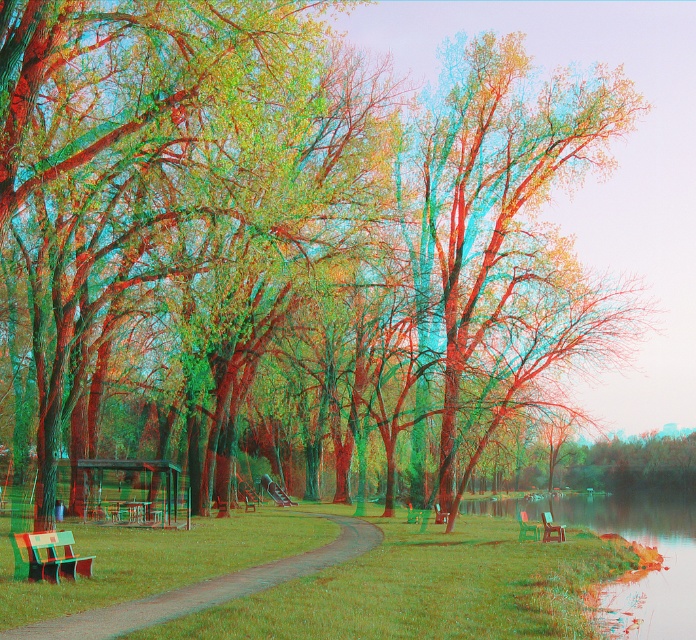
You are a maintenance worker needing to reach the wooden park bench at lower right from the green grassy path at center. Given that your cart can only move 50 feet before needing a recharge, will you be able to reach the bench without needing to recharge?

The green grassy path at center and wooden park bench at lower right are 46.20 feet apart. Since the distance is less than 50 feet, the maintenance worker can reach the wooden park bench at lower right without needing to recharge.